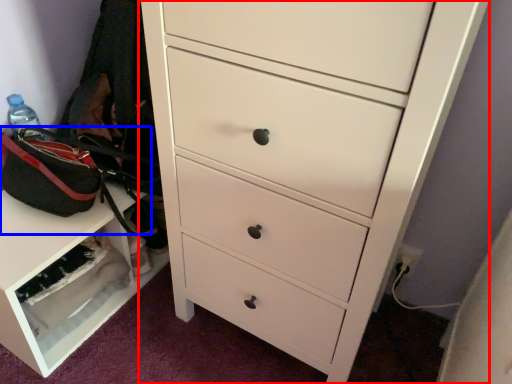
Question: Among these objects, which one is farthest to the camera, chest of drawers (highlighted by a red box) or messenger bag (highlighted by a blue box)?

Choices:
 (A) chest of drawers
 (B) messenger bag

Answer: (B)